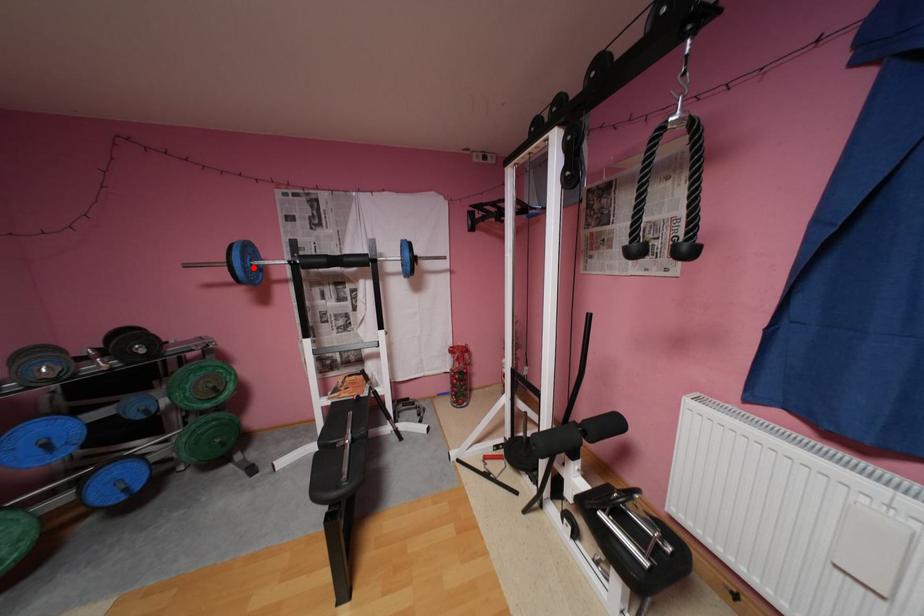
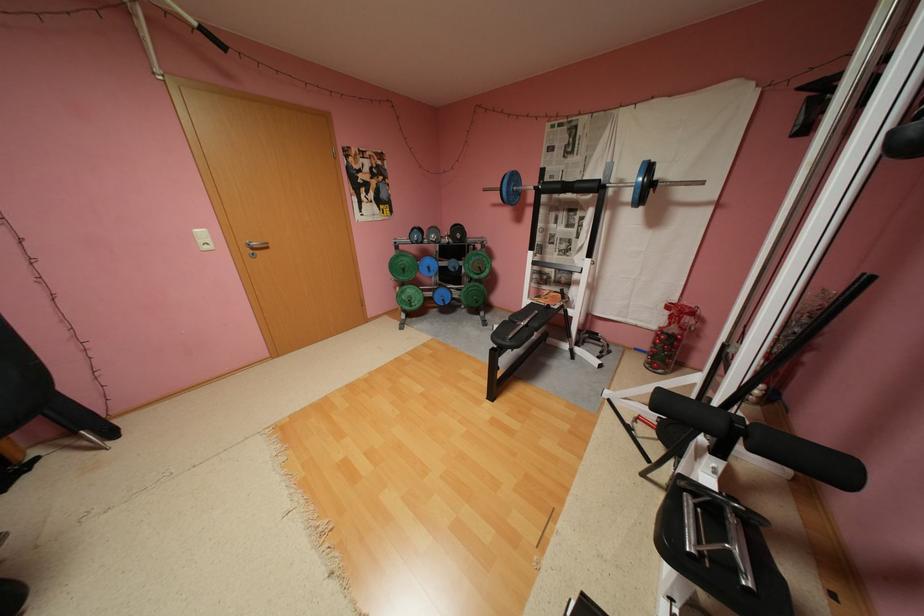
Locate, in the second image, the point that corresponds to the highlighted location in the first image.

(517, 191)